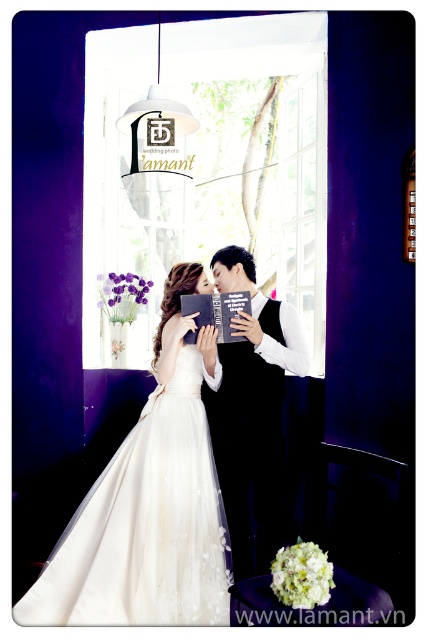
Question: Which object appears closest to the camera in this image?

Choices:
 (A) black satin suit at center
 (B) white satin dress at center

Answer: (B)

Question: Which point is farther to the camera?

Choices:
 (A) white satin dress at center
 (B) black satin suit at center

Answer: (B)

Question: Does white satin dress at center have a greater width compared to black satin suit at center?

Choices:
 (A) yes
 (B) no

Answer: (A)

Question: Which object is closer to the camera taking this photo?

Choices:
 (A) black satin suit at center
 (B) white satin dress at center

Answer: (B)

Question: Is white satin dress at center thinner than black satin suit at center?

Choices:
 (A) no
 (B) yes

Answer: (A)

Question: Is white satin dress at center bigger than black satin suit at center?

Choices:
 (A) yes
 (B) no

Answer: (A)